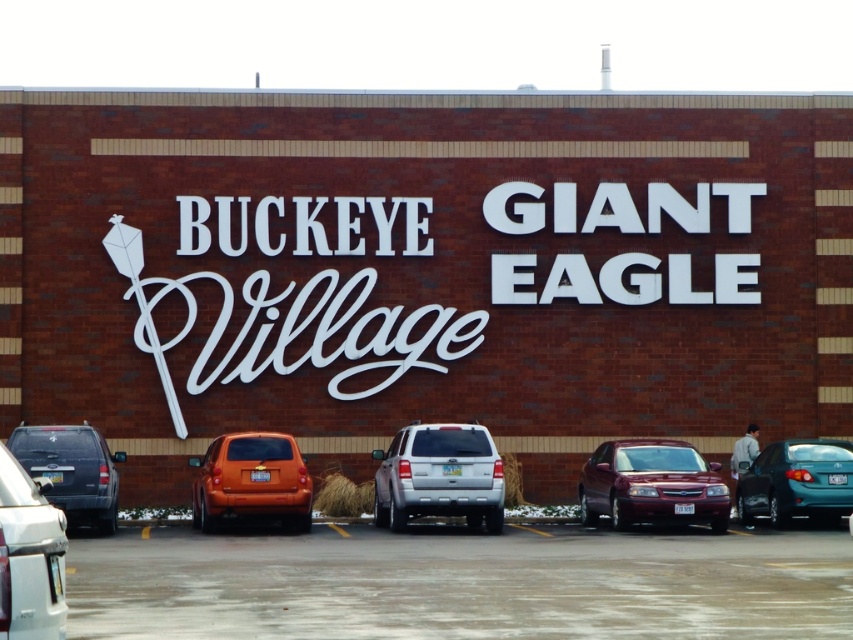
You are a delivery driver who needs to park your vehicle in the parking lot in front of BUCKEYE Village and GIANT EAGLE. You see a silver metallic suv at center and a shiny maroon sedan at center. Which vehicle is parked closer to the entrance of the building?

The silver metallic suv at center is located below the shiny maroon sedan at center, so the silver metallic suv at center is closer to the entrance of the building because it is positioned lower in the parking lot.

You are a delivery driver who needs to park your truck in the parking lot in front of BUCKEYE Village and GIANT EAGLE. Your truck is 6 feet tall. Can you safely park your truck between the silver metallic suv at center and the silver metallic suv at lower left?

The silver metallic suv at center is taller than the silver metallic suv at lower left. Since the truck is 6 feet tall, the truck can park between them as long as it stays under the height of the shorter SUV, which is the silver metallic suv at lower left. However, the exact height of the shorter SUV is not provided, so it is uncertain if it is taller than 6 feet. Without knowing the minimum height of the lower left SUV, we cannot confirm safety.